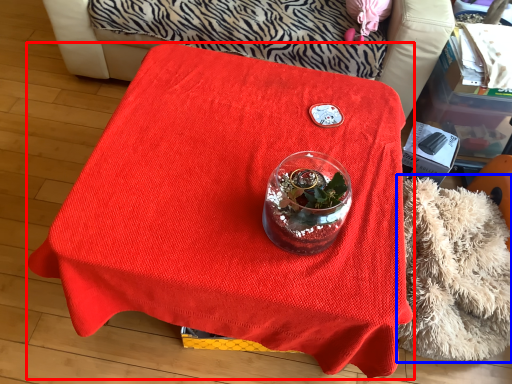
Question: Which object appears closest to the camera in this image, table (highlighted by a red box) or blanket (highlighted by a blue box)?

Choices:
 (A) table
 (B) blanket

Answer: (A)